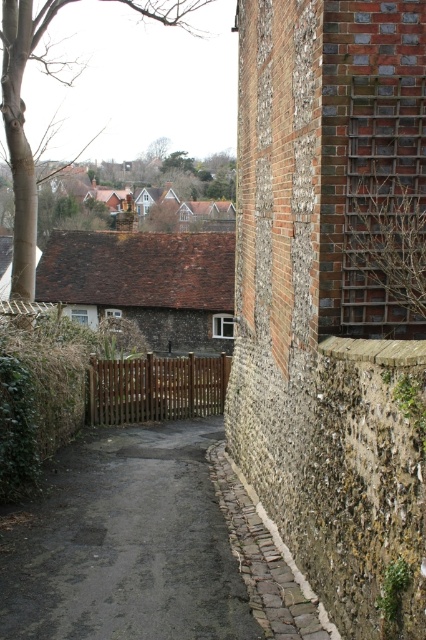
Which is behind, point (307, 608) or point (149, 371)?

Point (149, 371)

Is brown cobblestone path at lower center above brown wooden gate at center?

Actually, brown cobblestone path at lower center is below brown wooden gate at center.

The width and height of the screenshot is (426, 640). I want to click on brown cobblestone path at lower center, so click(x=264, y=561).

Is point (52, 19) farther from camera compared to point (282, 598)?

Yes, it is.

Is point (17, 196) positioned before point (249, 532)?

No.

Is point (164, 13) less distant than point (296, 582)?

No, (164, 13) is further to viewer.

I want to click on bare branches at upper left, so click(x=23, y=122).

Who is more forward, (169, 6) or (108, 422)?

Point (108, 422)

Which is behind, point (40, 26) or point (149, 358)?

Positioned behind is point (149, 358).

I want to click on bare branches at upper left, so click(23, 122).